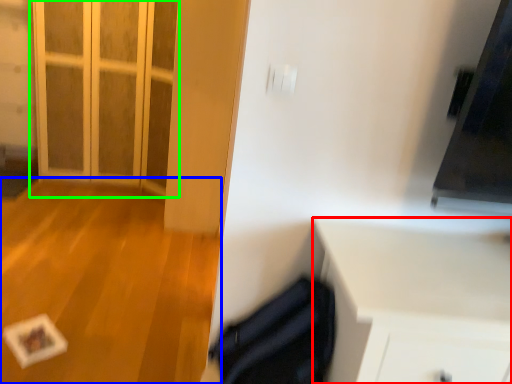
Question: Based on their relative distances, which object is nearer to cabinetry (highlighted by a red box)? Choose from plain (highlighted by a blue box) and door (highlighted by a green box).

Choices:
 (A) plain
 (B) door

Answer: (A)